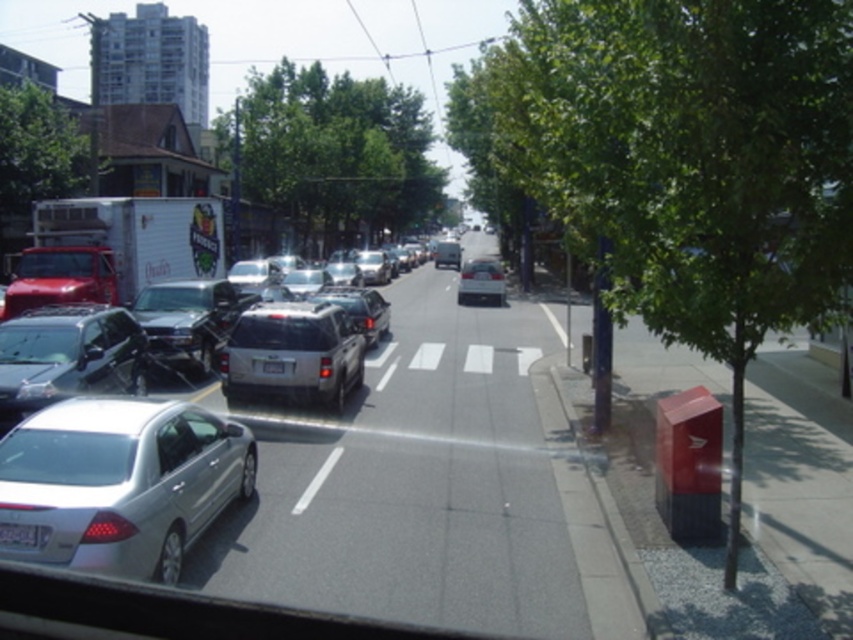
Can you confirm if green leafy tree at upper left is positioned to the left of white plastic license plate at lower left?

Indeed, green leafy tree at upper left is positioned on the left side of white plastic license plate at lower left.

The height and width of the screenshot is (640, 853). What are the coordinates of `green leafy tree at upper left` in the screenshot? It's located at (36, 157).

Which is more to the left, satin silver suv at center or green leafy tree at upper left?

green leafy tree at upper left is more to the left.

Does satin silver suv at center appear under green leafy tree at upper left?

Yes, satin silver suv at center is below green leafy tree at upper left.

Describe the element at coordinates (293, 353) in the screenshot. I see `satin silver suv at center` at that location.

This screenshot has width=853, height=640. What are the coordinates of `satin silver suv at center` in the screenshot? It's located at (x=293, y=353).

Who is lower down, green leafy tree at right or green leafy tree at center?

green leafy tree at right is below.

How far apart are green leafy tree at right and green leafy tree at center?

green leafy tree at right is 23.48 meters away from green leafy tree at center.

Which is behind, point (737, 524) or point (288, 179)?

The point (288, 179) is behind.

Where is `green leafy tree at right`? The height and width of the screenshot is (640, 853). green leafy tree at right is located at coordinates (679, 163).